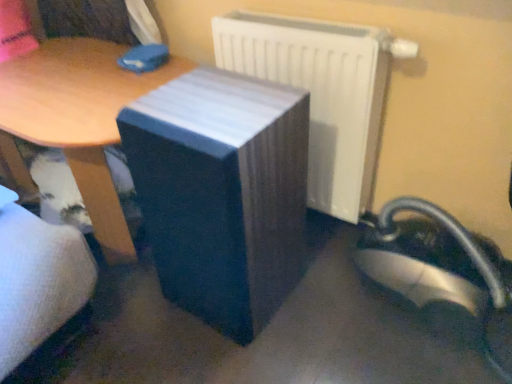
The width and height of the screenshot is (512, 384). What do you see at coordinates (323, 93) in the screenshot?
I see `white glossy radiator at upper right` at bounding box center [323, 93].

This screenshot has height=384, width=512. What do you see at coordinates (76, 120) in the screenshot?
I see `wooden table at center, arranged as the 1th table when viewed from the left` at bounding box center [76, 120].

The image size is (512, 384). What do you see at coordinates (222, 193) in the screenshot?
I see `matte black speaker at center, which is counted as the 1th table, starting from the right` at bounding box center [222, 193].

This screenshot has height=384, width=512. I want to click on white glossy radiator at upper right, so click(323, 93).

Is white glossy radiator at upper right positioned far away from wooden table at center, arranged as the 1th table when viewed from the left?

white glossy radiator at upper right is actually quite close to wooden table at center, arranged as the 1th table when viewed from the left.

Find the location of a particular element. The height and width of the screenshot is (384, 512). radiator above the wooden table at center, acting as the second table starting from the right (from a real-world perspective) is located at coordinates coord(323,93).

Between white glossy radiator at upper right and wooden table at center, arranged as the 1th table when viewed from the left, which one is positioned behind?

white glossy radiator at upper right is behind.

Based on the photo, could you measure the distance between white glossy radiator at upper right and wooden table at center, acting as the second table starting from the right?

The distance of white glossy radiator at upper right from wooden table at center, acting as the second table starting from the right, is 20.45 inches.

Is white glossy radiator at upper right oriented away from matte black speaker at center, which is the second table from left to right?

Yes.

Find the location of a particular element. The width and height of the screenshot is (512, 384). radiator that is on the right side of matte black speaker at center, which is counted as the 1th table, starting from the right is located at coordinates click(x=323, y=93).

Between point (315, 204) and point (169, 226), which one is positioned behind?

Point (315, 204)

Relative to matte black speaker at center, which is counted as the 1th table, starting from the right, is white glossy radiator at upper right in front or behind?

In the image, white glossy radiator at upper right appears behind matte black speaker at center, which is counted as the 1th table, starting from the right.

From a real-world perspective, is wooden table at center, acting as the second table starting from the right, on white glossy radiator at upper right?

No, from a real-world perspective, wooden table at center, acting as the second table starting from the right, is not on top of white glossy radiator at upper right.

In the image, is wooden table at center, acting as the second table starting from the right, on the left side or the right side of white glossy radiator at upper right?

Based on their positions, wooden table at center, acting as the second table starting from the right, is located to the left of white glossy radiator at upper right.

Would you say wooden table at center, acting as the second table starting from the right, is outside white glossy radiator at upper right?

wooden table at center, acting as the second table starting from the right, lies outside white glossy radiator at upper right's area.

Is wooden table at center, acting as the second table starting from the right, next to white glossy radiator at upper right?

No.

At what (x,y) coordinates should I click in order to perform the action: click on radiator on the right of matte black speaker at center, which is counted as the 1th table, starting from the right. Please return your answer as a coordinate pair (x, y). The height and width of the screenshot is (384, 512). Looking at the image, I should click on (323, 93).

Which is in front, point (140, 125) or point (323, 189)?

The point (140, 125) is in front.

Which object is closer to the camera taking this photo, matte black speaker at center, which is counted as the 1th table, starting from the right, or white glossy radiator at upper right?

matte black speaker at center, which is counted as the 1th table, starting from the right, is more forward.

Would you say matte black speaker at center, which is counted as the 1th table, starting from the right, is inside or outside wooden table at center, arranged as the 1th table when viewed from the left?

matte black speaker at center, which is counted as the 1th table, starting from the right, is not inside wooden table at center, arranged as the 1th table when viewed from the left, it's outside.

Which object is closer to the camera, matte black speaker at center, which is the second table from left to right, or wooden table at center, acting as the second table starting from the right?

matte black speaker at center, which is the second table from left to right.

From the image's perspective, is matte black speaker at center, which is counted as the 1th table, starting from the right, above or below wooden table at center, arranged as the 1th table when viewed from the left?

matte black speaker at center, which is counted as the 1th table, starting from the right, is below wooden table at center, arranged as the 1th table when viewed from the left.

Considering the relative sizes of wooden table at center, acting as the second table starting from the right, and matte black speaker at center, which is counted as the 1th table, starting from the right, in the image provided, is wooden table at center, acting as the second table starting from the right, wider than matte black speaker at center, which is counted as the 1th table, starting from the right,?

Yes.

Between wooden table at center, acting as the second table starting from the right, and matte black speaker at center, which is the second table from left to right, which one is positioned behind?

Positioned behind is wooden table at center, acting as the second table starting from the right.

Choose the correct answer: Is wooden table at center, acting as the second table starting from the right, inside matte black speaker at center, which is the second table from left to right, or outside it?

wooden table at center, acting as the second table starting from the right, cannot be found inside matte black speaker at center, which is the second table from left to right.

There is a wooden table at center, arranged as the 1th table when viewed from the left. Identify the location of radiator above it (from a real-world perspective). The image size is (512, 384). (323, 93).

The height and width of the screenshot is (384, 512). Find the location of `the 2nd table below the white glossy radiator at upper right (from the image's perspective)`. the 2nd table below the white glossy radiator at upper right (from the image's perspective) is located at coordinates (222, 193).

Considering their positions, is wooden table at center, arranged as the 1th table when viewed from the left, positioned closer to matte black speaker at center, which is counted as the 1th table, starting from the right, than white glossy radiator at upper right?

The object closer to matte black speaker at center, which is counted as the 1th table, starting from the right, is white glossy radiator at upper right.

Based on their spatial positions, is matte black speaker at center, which is the second table from left to right, or white glossy radiator at upper right closer to wooden table at center, arranged as the 1th table when viewed from the left?

The object closer to wooden table at center, arranged as the 1th table when viewed from the left, is matte black speaker at center, which is the second table from left to right.

Which object lies nearer to the anchor point white glossy radiator at upper right, wooden table at center, arranged as the 1th table when viewed from the left, or matte black speaker at center, which is the second table from left to right?

matte black speaker at center, which is the second table from left to right.

Considering their positions, is white glossy radiator at upper right positioned closer to wooden table at center, acting as the second table starting from the right, than matte black speaker at center, which is the second table from left to right?

Based on the image, matte black speaker at center, which is the second table from left to right, appears to be nearer to wooden table at center, acting as the second table starting from the right.

From the picture: When comparing their distances from matte black speaker at center, which is the second table from left to right, does white glossy radiator at upper right or wooden table at center, arranged as the 1th table when viewed from the left, seem closer?

The object closer to matte black speaker at center, which is the second table from left to right, is white glossy radiator at upper right.

Based on their spatial positions, is matte black speaker at center, which is counted as the 1th table, starting from the right, or wooden table at center, arranged as the 1th table when viewed from the left, closer to white glossy radiator at upper right?

matte black speaker at center, which is counted as the 1th table, starting from the right.

Where is `table between wooden table at center, arranged as the 1th table when viewed from the left, and white glossy radiator at upper right from left to right`? Image resolution: width=512 pixels, height=384 pixels. table between wooden table at center, arranged as the 1th table when viewed from the left, and white glossy radiator at upper right from left to right is located at coordinates (222, 193).